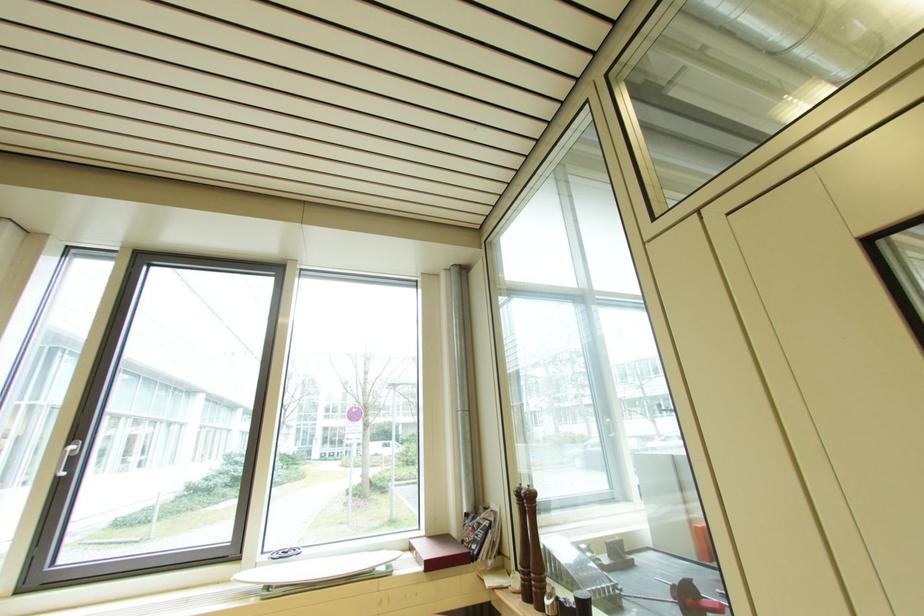
The width and height of the screenshot is (924, 616). What do you see at coordinates (67, 456) in the screenshot?
I see `the silver window handle` at bounding box center [67, 456].